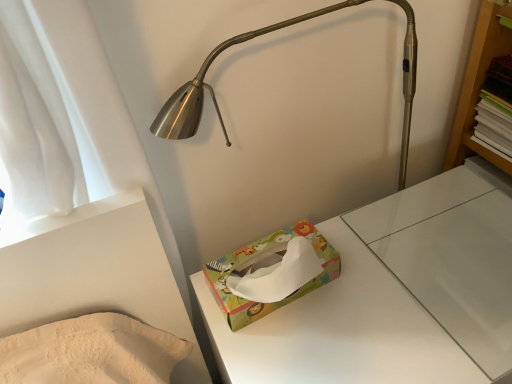
The width and height of the screenshot is (512, 384). What are the coordinates of `free space above multicolored paper tissue box at center (from a real-world perspective)` in the screenshot? It's located at (402, 276).